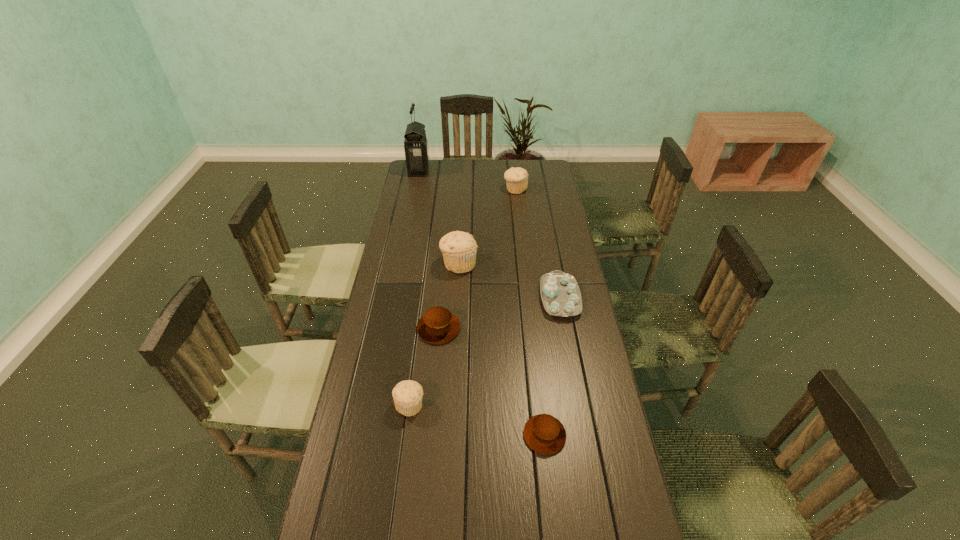
At what (x,y) coordinates should I click in order to perform the action: click on the farthest object. Please return your answer as a coordinate pair (x, y). Looking at the image, I should click on (416, 150).

Locate an element on the screen. The width and height of the screenshot is (960, 540). lantern is located at coordinates (416, 150).

Identify the location of the biggest beige muffin. The width and height of the screenshot is (960, 540). coord(459,248).

Where is `the fifth nearest object`? This screenshot has height=540, width=960. the fifth nearest object is located at coordinates (459, 248).

You are a GUI agent. You are given a task and a screenshot of the screen. Output one action in this format:
    pyautogui.click(x=<x>, y=<y>)
    Task: Click on the farthest muffin
    
    Given the screenshot: What is the action you would take?
    pyautogui.click(x=516, y=178)

Locate an element on the screen. The height and width of the screenshot is (540, 960). the fourth shortest muffin is located at coordinates (516, 178).

Find the location of `blue chinaware`. blue chinaware is located at coordinates (560, 293).

This screenshot has height=540, width=960. Identify the location of the leftmost beige muffin. (407, 395).

I want to click on the nearest beige muffin, so click(x=407, y=395).

This screenshot has width=960, height=540. I want to click on the third farthest muffin, so click(x=438, y=325).